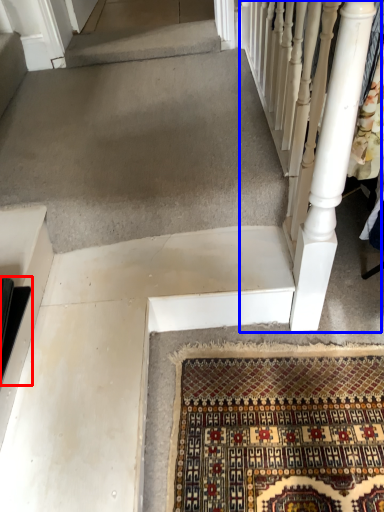
Question: Among these objects, which one is farthest to the camera, stairs (highlighted by a red box) or rail (highlighted by a blue box)?

Choices:
 (A) stairs
 (B) rail

Answer: (A)